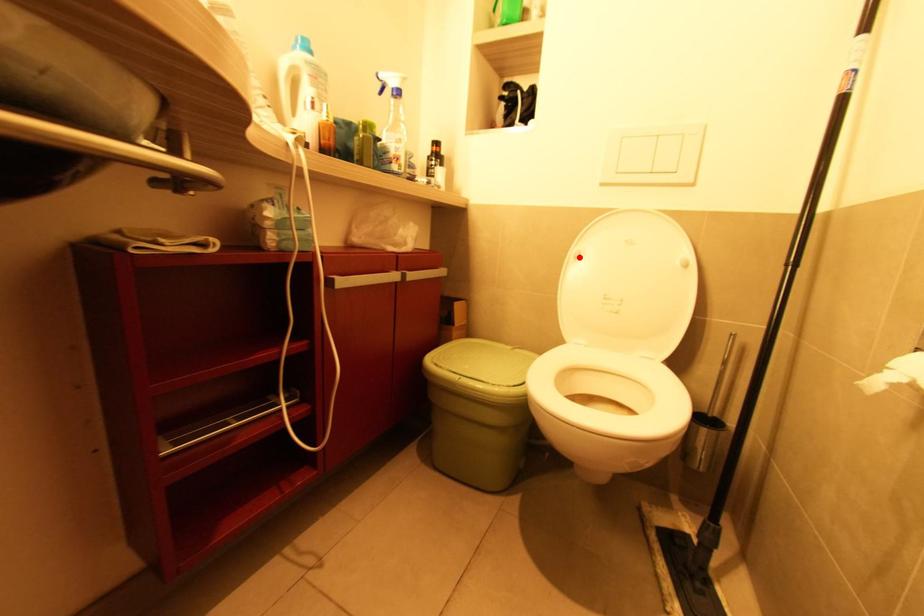
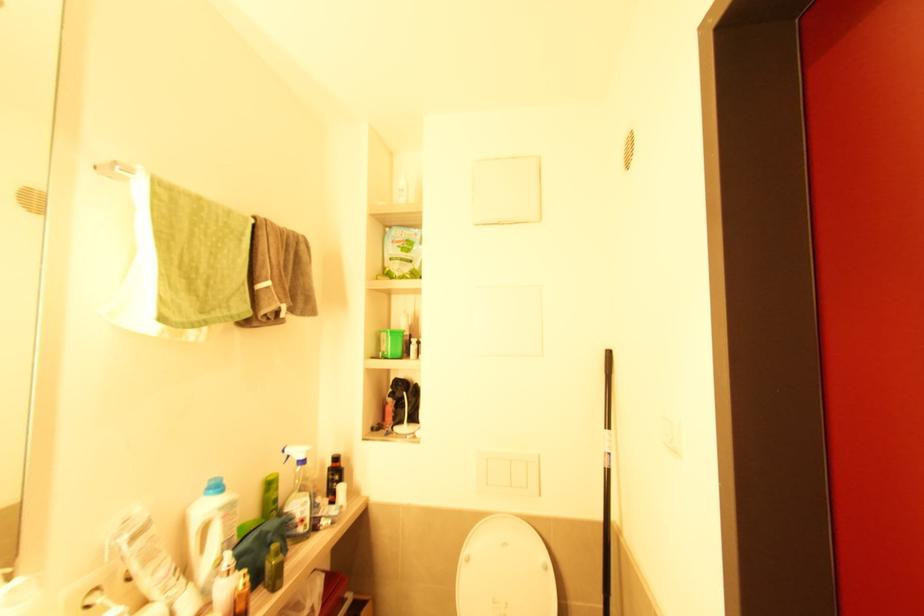
Where in the second image is the point corresponding to the highlighted location from the first image?

(469, 561)